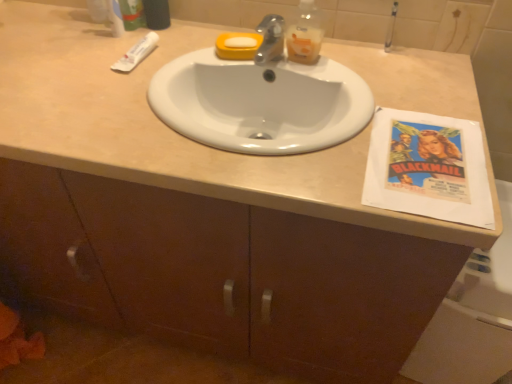
Where is `white matte tube at upper left`? This screenshot has height=384, width=512. white matte tube at upper left is located at coordinates (136, 53).

You are a GUI agent. You are given a task and a screenshot of the screen. Output one action in this format:
    pyautogui.click(x=<x>, y=<y>)
    Task: Click on the white glossy sink at center
    
    Given the screenshot: What is the action you would take?
    pyautogui.click(x=260, y=103)

You are a GUI agent. You are given a task and a screenshot of the screen. Output one action in this format:
    pyautogui.click(x=<x>, y=<y>)
    Task: Click on the white matte tube at upper left
    Image resolution: width=512 pixels, height=384 pixels.
    Given the screenshot: What is the action you would take?
    pyautogui.click(x=136, y=53)

Are white glossy sink at center and green matte toothpaste tube at upper left located far from each other?

No, there isn't a large distance between white glossy sink at center and green matte toothpaste tube at upper left.

What's the angular difference between white glossy sink at center and green matte toothpaste tube at upper left's facing directions?

9.55e-05 degrees separate the facing orientations of white glossy sink at center and green matte toothpaste tube at upper left.

From a real-world perspective, which is physically below, white glossy sink at center or green matte toothpaste tube at upper left?

white glossy sink at center is physically lower.

Consider the image. Which object is closer to the camera, white glossy sink at center or green matte toothpaste tube at upper left?

Positioned in front is white glossy sink at center.

Considering the positions of objects translucent plastic bottle at upper center and white glossy sink at center in the image provided, who is in front, translucent plastic bottle at upper center or white glossy sink at center?

Positioned in front is white glossy sink at center.

Is translucent plastic bottle at upper center outside of white glossy sink at center?

Yes, translucent plastic bottle at upper center is located beyond the bounds of white glossy sink at center.

Is point (308, 39) closer to camera compared to point (242, 93)?

Yes, it is.

Is translucent plastic bottle at upper center next to white glossy sink at center?

They are not placed beside each other.

Where is `bath in front of the white matte tube at upper left`? This screenshot has width=512, height=384. bath in front of the white matte tube at upper left is located at coordinates (472, 317).

Which of these two, white paper at right or white matte tube at upper left, is bigger?

With larger size is white paper at right.

Does white paper at right have a lesser height compared to white matte tube at upper left?

Incorrect, the height of white paper at right does not fall short of that of white matte tube at upper left.

Is white paper at right positioned with its back to white matte tube at upper left?

No, white paper at right is not facing away from white matte tube at upper left.

Between white paper at right and green matte toothpaste tube at upper left, which one appears on the right side from the viewer's perspective?

white paper at right.

The width and height of the screenshot is (512, 384). I want to click on bath that appears below the green matte toothpaste tube at upper left (from the image's perspective), so click(x=472, y=317).

From a real-world perspective, between white paper at right and green matte toothpaste tube at upper left, who is vertically higher?

From a 3D spatial view, green matte toothpaste tube at upper left is above.

Could you tell me if white paper at right is facing green matte toothpaste tube at upper left?

No, white paper at right does not turn towards green matte toothpaste tube at upper left.

Looking at this image, from a real-world perspective, between green matte toothpaste tube at upper left and white glossy sink at center, who is vertically higher?

green matte toothpaste tube at upper left, from a real-world perspective.

This screenshot has width=512, height=384. What are the coordinates of `toiletry located above the white glossy sink at center (from a real-world perspective)` in the screenshot? It's located at (132, 14).

Is green matte toothpaste tube at upper left oriented away from white glossy sink at center?

No, green matte toothpaste tube at upper left's orientation is not away from white glossy sink at center.

In terms of height, does green matte toothpaste tube at upper left look taller or shorter compared to white glossy sink at center?

green matte toothpaste tube at upper left is taller than white glossy sink at center.

From the picture: From a real-world perspective, is white glossy sink at center beneath white matte tube at upper left?

Correct, in the physical world, white glossy sink at center is lower than white matte tube at upper left.

Consider the image. From the image's perspective, is white glossy sink at center below white matte tube at upper left?

Yes.

The width and height of the screenshot is (512, 384). Identify the location of sink on the right side of white matte tube at upper left. (260, 103).

Between white glossy sink at center and white matte tube at upper left, which one is positioned in front?

white glossy sink at center.

In the scene shown: Between white paper at right and white glossy sink at center, which one appears on the left side from the viewer's perspective?

From the viewer's perspective, white glossy sink at center appears more on the left side.

From the picture: Considering the sizes of objects white paper at right and white glossy sink at center in the image provided, who is wider, white paper at right or white glossy sink at center?

With larger width is white paper at right.

Which is behind, point (496, 332) or point (344, 73)?

The point (496, 332) is farther from the camera.

Locate an element on the screen. toiletry located above the white glossy sink at center (from a real-world perspective) is located at coordinates (132, 14).

Where is `sink that is below the translucent plastic bottle at upper center (from the image's perspective)`? This screenshot has height=384, width=512. sink that is below the translucent plastic bottle at upper center (from the image's perspective) is located at coordinates (260, 103).

Considering their positions, is white matte tube at upper left positioned closer to green matte toothpaste tube at upper left than white paper at right?

The object closer to green matte toothpaste tube at upper left is white matte tube at upper left.

Considering their positions, is white glossy sink at center positioned closer to white paper at right than green matte toothpaste tube at upper left?

The object closer to white paper at right is white glossy sink at center.

Looking at the image, which one is located closer to white glossy sink at center, translucent plastic bottle at upper center or white matte tube at upper left?

translucent plastic bottle at upper center.

Looking at the image, which one is located further to white glossy sink at center, white matte tube at upper left or translucent plastic bottle at upper center?

Among the two, white matte tube at upper left is located further to white glossy sink at center.

When comparing their distances from white matte tube at upper left, does white glossy sink at center or translucent plastic bottle at upper center seem further?

Based on the image, translucent plastic bottle at upper center appears to be further to white matte tube at upper left.

Considering their positions, is white glossy sink at center positioned closer to green matte toothpaste tube at upper left than white matte tube at upper left?

white matte tube at upper left.

From the image, which object appears to be farther from white paper at right, white matte tube at upper left or translucent plastic bottle at upper center?

Among the two, white matte tube at upper left is located further to white paper at right.

From the image, which object appears to be farther from green matte toothpaste tube at upper left, translucent plastic bottle at upper center or white paper at right?

Based on the image, white paper at right appears to be further to green matte toothpaste tube at upper left.

Identify the location of sink between green matte toothpaste tube at upper left and translucent plastic bottle at upper center in the horizontal direction. The width and height of the screenshot is (512, 384). (260, 103).

This screenshot has height=384, width=512. What are the coordinates of `sink between white matte tube at upper left and translucent plastic bottle at upper center from left to right` in the screenshot? It's located at [x=260, y=103].

Image resolution: width=512 pixels, height=384 pixels. I want to click on toothpaste between green matte toothpaste tube at upper left and white glossy sink at center vertically, so click(136, 53).

Identify the location of sink between translucent plastic bottle at upper center and white paper at right from top to bottom. Image resolution: width=512 pixels, height=384 pixels. (260, 103).